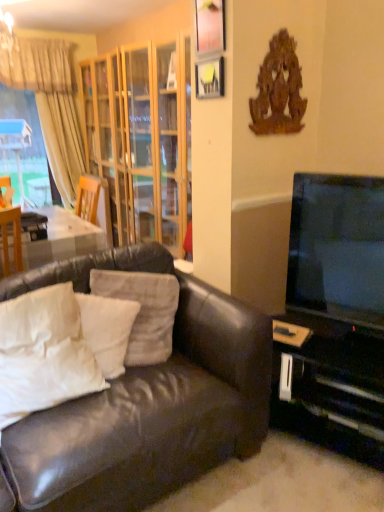
In order to click on white soft pillow at left, the 1th pillow from the left in this screenshot , I will do `click(43, 353)`.

Measure the distance between white soft pillow at left, the 1th pillow from the left, and camera.

white soft pillow at left, the 1th pillow from the left, and camera are 4.93 feet apart from each other.

Measure the distance between white soft pillow at center, placed as the 1th pillow when sorted from right to left, and camera.

The distance of white soft pillow at center, placed as the 1th pillow when sorted from right to left, from camera is 1.84 meters.

You are a GUI agent. You are given a task and a screenshot of the screen. Output one action in this format:
    pyautogui.click(x=<x>, y=<y>)
    Task: Click on the black plastic entertainment center at right
    
    Given the screenshot: What is the action you would take?
    pyautogui.click(x=330, y=384)

What do you see at coordinates (210, 78) in the screenshot?
I see `matte yellow picture frame at upper center, acting as the 1th picture frame starting from the bottom` at bounding box center [210, 78].

Describe the element at coordinates (142, 138) in the screenshot. I see `light wood/glass cabinet at upper left` at that location.

The height and width of the screenshot is (512, 384). Identify the location of flat screen tv at right. (337, 248).

From a real-world perspective, starting from the white soft pillow at left, the 3th pillow in the right-to-left sequence, which picture frame is the 2nd one vertically above it? Please provide its 2D coordinates.

[(210, 26)]

Can you confirm if white soft pillow at left, the 1th pillow from the left, is smaller than wooden picture frame at upper center, which ranks as the 2th picture frame in bottom-to-top order?

Incorrect, white soft pillow at left, the 1th pillow from the left, is not smaller in size than wooden picture frame at upper center, which ranks as the 2th picture frame in bottom-to-top order.

From the image's perspective, which object appears higher, white soft pillow at left, the 1th pillow from the left, or wooden picture frame at upper center, which ranks as the first picture frame in top-to-bottom order?

wooden picture frame at upper center, which ranks as the first picture frame in top-to-bottom order, appears higher in the image.

Is white soft pillow at left, the 1th pillow from the left, aimed at wooden picture frame at upper center, which ranks as the first picture frame in top-to-bottom order?

No, white soft pillow at left, the 1th pillow from the left, is not aimed at wooden picture frame at upper center, which ranks as the first picture frame in top-to-bottom order.

Is wooden picture frame at upper center, which ranks as the first picture frame in top-to-bottom order, directly adjacent to black plastic entertainment center at right?

wooden picture frame at upper center, which ranks as the first picture frame in top-to-bottom order, and black plastic entertainment center at right are not in contact.

Can black plastic entertainment center at right be found inside wooden picture frame at upper center, which ranks as the first picture frame in top-to-bottom order?

No, black plastic entertainment center at right is located outside of wooden picture frame at upper center, which ranks as the first picture frame in top-to-bottom order.

Is wooden picture frame at upper center, which ranks as the first picture frame in top-to-bottom order, shorter than black plastic entertainment center at right?

Correct, wooden picture frame at upper center, which ranks as the first picture frame in top-to-bottom order, is not as tall as black plastic entertainment center at right.

The width and height of the screenshot is (384, 512). What are the coordinates of `the 2nd picture frame to the left of the flat screen tv at right, counting from the anchor's position` in the screenshot? It's located at (210, 26).

Is point (201, 30) closer to viewer compared to point (360, 241)?

No, it is not.

From the image's perspective, which one is positioned higher, wooden picture frame at upper center, which ranks as the first picture frame in top-to-bottom order, or flat screen tv at right?

wooden picture frame at upper center, which ranks as the first picture frame in top-to-bottom order, appears higher in the image.

Would you say wooden picture frame at upper center, which ranks as the 2th picture frame in bottom-to-top order, is inside or outside flat screen tv at right?

wooden picture frame at upper center, which ranks as the 2th picture frame in bottom-to-top order, is outside flat screen tv at right.

Is flat screen tv at right wider or thinner than matte yellow picture frame at upper center, acting as the 1th picture frame starting from the bottom?

In the image, flat screen tv at right appears to be wider than matte yellow picture frame at upper center, acting as the 1th picture frame starting from the bottom.

Is flat screen tv at right far away from matte yellow picture frame at upper center, acting as the 1th picture frame starting from the bottom?

That's not correct — flat screen tv at right is a little close to matte yellow picture frame at upper center, acting as the 1th picture frame starting from the bottom.

Does flat screen tv at right have a larger size compared to matte yellow picture frame at upper center, acting as the 1th picture frame starting from the bottom?

Yes, flat screen tv at right is bigger than matte yellow picture frame at upper center, acting as the 1th picture frame starting from the bottom.

From the image's perspective, which object appears higher, flat screen tv at right or matte yellow picture frame at upper center, acting as the 1th picture frame starting from the bottom?

From the image's view, matte yellow picture frame at upper center, acting as the 1th picture frame starting from the bottom, is above.

From the picture: Which of these two, flat screen tv at right or black plastic entertainment center at right, is smaller?

Smaller between the two is flat screen tv at right.

Is flat screen tv at right at the left side of black plastic entertainment center at right?

Correct, you'll find flat screen tv at right to the left of black plastic entertainment center at right.

Does flat screen tv at right have a lesser width compared to black plastic entertainment center at right?

Yes.

Consider the image. Is flat screen tv at right further to the viewer compared to black plastic entertainment center at right?

No.

From the image's perspective, is flat screen tv at right below white soft pillow at center, placed as the 1th pillow when sorted from right to left?

Actually, flat screen tv at right appears above white soft pillow at center, placed as the 1th pillow when sorted from right to left, in the image.

Is flat screen tv at right at the right side of white soft pillow at center, placed as the 1th pillow when sorted from right to left?

Yes, flat screen tv at right is to the right of white soft pillow at center, placed as the 1th pillow when sorted from right to left.

This screenshot has height=512, width=384. There is a flat screen tv at right. Find the location of `the 1st pillow below it (from a real-world perspective)`. the 1st pillow below it (from a real-world perspective) is located at coordinates (143, 311).

Does flat screen tv at right turn towards white soft pillow at center, which appears as the 3th pillow when viewed from the left?

No, flat screen tv at right is not aimed at white soft pillow at center, which appears as the 3th pillow when viewed from the left.

Is black plastic entertainment center at right completely or partially inside beige fabric curtain at upper left?

No.

Considering the points (51, 63) and (272, 408), which point is behind, point (51, 63) or point (272, 408)?

The point (51, 63) is more distant.

Is beige fabric curtain at upper left to the left or to the right of black plastic entertainment center at right in the image?

From the image, it's evident that beige fabric curtain at upper left is to the left of black plastic entertainment center at right.

From the image's perspective, is beige fabric curtain at upper left located above or below black plastic entertainment center at right?

From the image's perspective, beige fabric curtain at upper left appears above black plastic entertainment center at right.

From a real-world perspective, count 2nd pillows downward from the wooden picture frame at upper center, which ranks as the 2th picture frame in bottom-to-top order, and point to it. Please provide its 2D coordinates.

[(43, 353)]

Locate an element on the screen. The width and height of the screenshot is (384, 512). the 2nd picture frame located above the black plastic entertainment center at right (from a real-world perspective) is located at coordinates (210, 26).

Looking at the image, which one is located closer to black plastic entertainment center at right, matte yellow picture frame at upper center, the 2th picture frame positioned from the top, or white soft pillow at left, the 1th pillow from the left?

white soft pillow at left, the 1th pillow from the left, lies closer to black plastic entertainment center at right than the other object.

Looking at the image, which one is located closer to beige fabric curtain at upper left, white soft pillow at center, placed as the 1th pillow when sorted from right to left, or leather couch at lower left?

white soft pillow at center, placed as the 1th pillow when sorted from right to left, is positioned closer to the anchor beige fabric curtain at upper left.

Estimate the real-world distances between objects in this image. Which object is further from white soft pillow at left, the 3th pillow in the right-to-left sequence, beige fabric curtain at upper left or wooden picture frame at upper center, which ranks as the 2th picture frame in bottom-to-top order?

beige fabric curtain at upper left is positioned further to the anchor white soft pillow at left, the 3th pillow in the right-to-left sequence.

Considering their positions, is beige fabric curtain at upper left positioned closer to white soft pillow at left, the 1th pillow from the left, than flat screen tv at right?

Based on the image, flat screen tv at right appears to be nearer to white soft pillow at left, the 1th pillow from the left.

Estimate the real-world distances between objects in this image. Which object is further from light wood/glass cabinet at upper left, white soft pillow at center, the second pillow in the right-to-left sequence, or black plastic entertainment center at right?

black plastic entertainment center at right lies further to light wood/glass cabinet at upper left than the other object.

Looking at the image, which one is located further to black plastic entertainment center at right, leather couch at lower left or flat screen tv at right?

Among the two, leather couch at lower left is located further to black plastic entertainment center at right.

When comparing their distances from white soft pillow at center, placed as the 1th pillow when sorted from right to left, does beige fabric curtain at upper left or white soft pillow at left, the 3th pillow in the right-to-left sequence, seem closer?

white soft pillow at left, the 3th pillow in the right-to-left sequence.

From the image, which object appears to be nearer to wooden picture frame at upper center, which ranks as the 2th picture frame in bottom-to-top order, matte yellow picture frame at upper center, acting as the 1th picture frame starting from the bottom, or beige fabric curtain at upper left?

matte yellow picture frame at upper center, acting as the 1th picture frame starting from the bottom, is positioned closer to the anchor wooden picture frame at upper center, which ranks as the 2th picture frame in bottom-to-top order.

Where is `cabinetry located between matte yellow picture frame at upper center, the 2th picture frame positioned from the top, and beige fabric curtain at upper left in the depth direction`? Image resolution: width=384 pixels, height=512 pixels. cabinetry located between matte yellow picture frame at upper center, the 2th picture frame positioned from the top, and beige fabric curtain at upper left in the depth direction is located at coordinates (142, 138).

Find the location of a particular element. The image size is (384, 512). picture frame between wooden picture frame at upper center, which ranks as the first picture frame in top-to-bottom order, and flat screen tv at right in the up-down direction is located at coordinates (210, 78).

The width and height of the screenshot is (384, 512). I want to click on television positioned between leather couch at lower left and light wood/glass cabinet at upper left from near to far, so click(x=337, y=248).

Identify the location of television that lies between matte yellow picture frame at upper center, acting as the 1th picture frame starting from the bottom, and white soft pillow at center, the 2th pillow in the left-to-right sequence, from top to bottom. [x=337, y=248].